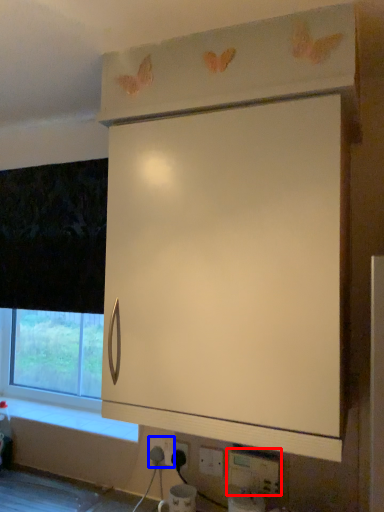
Question: Which object is closer to the camera taking this photo, electric outlet (highlighted by a red box) or electric outlet (highlighted by a blue box)?

Choices:
 (A) electric outlet
 (B) electric outlet

Answer: (A)